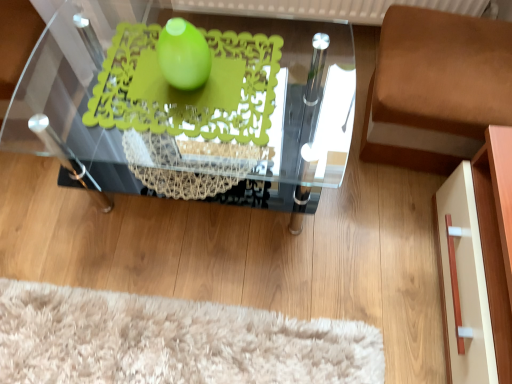
Question: From a real-world perspective, does green matte doily at center sit lower than green matte sphere at center?

Choices:
 (A) yes
 (B) no

Answer: (A)

Question: Is green matte doily at center positioned far away from green matte sphere at center?

Choices:
 (A) yes
 (B) no

Answer: (B)

Question: Is green matte doily at center located outside green matte sphere at center?

Choices:
 (A) no
 (B) yes

Answer: (B)

Question: Can green matte sphere at center be found inside green matte doily at center?

Choices:
 (A) no
 (B) yes

Answer: (A)

Question: Is green matte doily at center turned away from green matte sphere at center?

Choices:
 (A) yes
 (B) no

Answer: (B)

Question: From their relative heights in the image, would you say green matte doily at center is taller or shorter than green matte sphere at center?

Choices:
 (A) tall
 (B) short

Answer: (B)

Question: Considering the positions of point (153, 86) and point (196, 77), is point (153, 86) closer or farther from the camera than point (196, 77)?

Choices:
 (A) farther
 (B) closer

Answer: (A)

Question: In terms of size, does green matte doily at center appear bigger or smaller than green matte sphere at center?

Choices:
 (A) big
 (B) small

Answer: (A)

Question: From a real-world perspective, relative to green matte sphere at center, is green matte doily at center vertically above or below?

Choices:
 (A) below
 (B) above

Answer: (A)

Question: Considering the positions of transparent glass table at center and green matte sphere at center in the image, is transparent glass table at center taller or shorter than green matte sphere at center?

Choices:
 (A) short
 (B) tall

Answer: (B)

Question: Visually, is transparent glass table at center positioned to the left or to the right of green matte sphere at center?

Choices:
 (A) left
 (B) right

Answer: (A)

Question: From a real-world perspective, is transparent glass table at center positioned above or below green matte sphere at center?

Choices:
 (A) above
 (B) below

Answer: (B)

Question: From the image's perspective, is transparent glass table at center located above or below green matte sphere at center?

Choices:
 (A) below
 (B) above

Answer: (A)

Question: In terms of size, does transparent glass table at center appear bigger or smaller than brown fabric cushion at right?

Choices:
 (A) small
 (B) big

Answer: (B)

Question: From a real-world perspective, is transparent glass table at center above or below brown fabric cushion at right?

Choices:
 (A) above
 (B) below

Answer: (A)